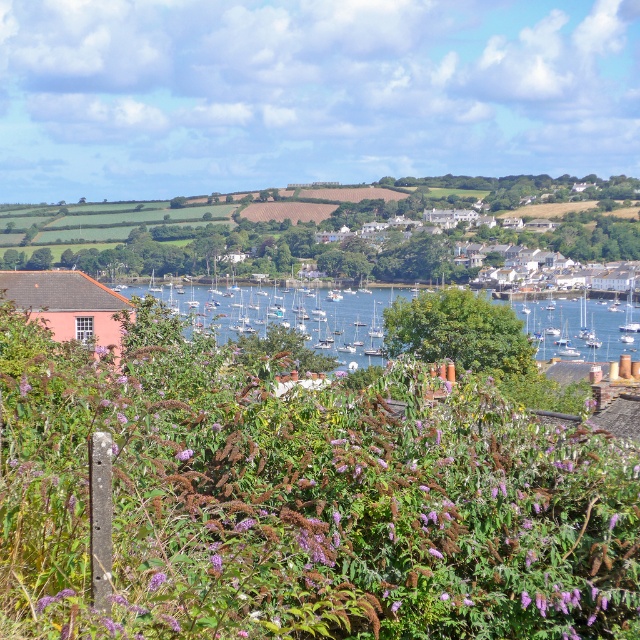
Question: Among these objects, which one is nearest to the camera?

Choices:
 (A) white glossy sailboat at center
 (B) blue water at center

Answer: (B)

Question: Which point is farther to the camera?

Choices:
 (A) (86, 362)
 (B) (611, 332)
 (C) (634, 326)

Answer: (B)

Question: Is purple fuzzy bush at center bigger than white glossy sailboat at center?

Choices:
 (A) yes
 (B) no

Answer: (B)

Question: Is purple fuzzy bush at center above blue water at center?

Choices:
 (A) yes
 (B) no

Answer: (A)

Question: Can you confirm if blue water at center is wider than white glossy sailboat at center?

Choices:
 (A) no
 (B) yes

Answer: (B)

Question: Which of the following is the closest to the observer?

Choices:
 (A) (392, 346)
 (B) (628, 314)
 (C) (540, 621)

Answer: (C)